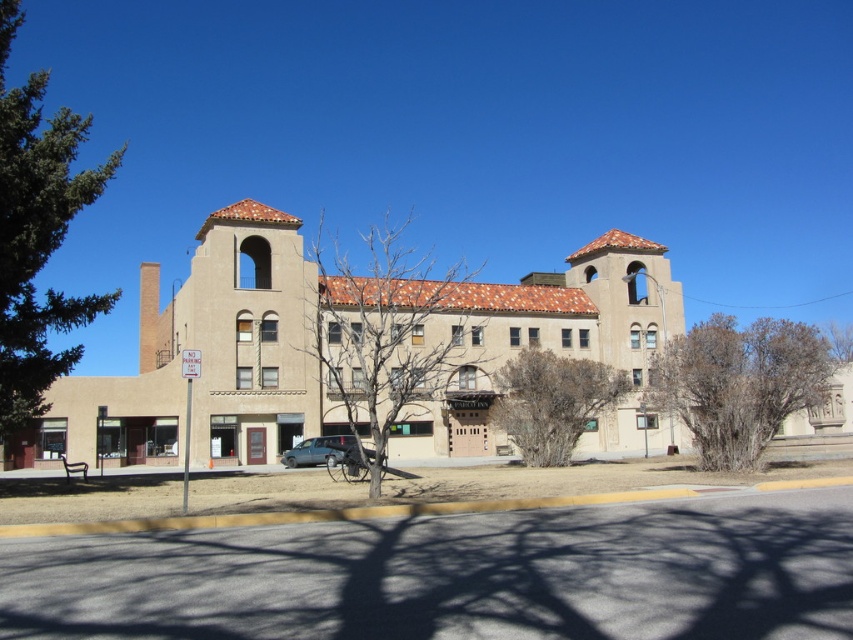
Is green leafy tree at left positioned behind brown textured tree at center?

No, it is not.

Does green leafy tree at left have a greater height compared to brown textured tree at center?

Correct, green leafy tree at left is much taller as brown textured tree at center.

Which is in front, point (28, 419) or point (585, 417)?

Positioned in front is point (28, 419).

Identify the location of green leafy tree at left. The image size is (853, 640). (38, 232).

Is the position of beige stucco church at center less distant than that of metallic silver car at center?

Yes, beige stucco church at center is closer to the viewer.

Which is below, beige stucco church at center or metallic silver car at center?

Positioned lower is metallic silver car at center.

Is point (305, 324) positioned before point (306, 445)?

No, it is not.

Find the location of a particular element. The image size is (853, 640). beige stucco church at center is located at coordinates (209, 358).

Between beige stucco church at center and bare branches at center, which one is positioned higher?

bare branches at center is higher up.

Between beige stucco church at center and bare branches at center, which one appears on the left side from the viewer's perspective?

From the viewer's perspective, bare branches at center appears more on the left side.

You are a GUI agent. You are given a task and a screenshot of the screen. Output one action in this format:
    pyautogui.click(x=<x>, y=<y>)
    Task: Click on the beige stucco church at center
    This screenshot has width=853, height=640.
    Given the screenshot: What is the action you would take?
    point(209,358)